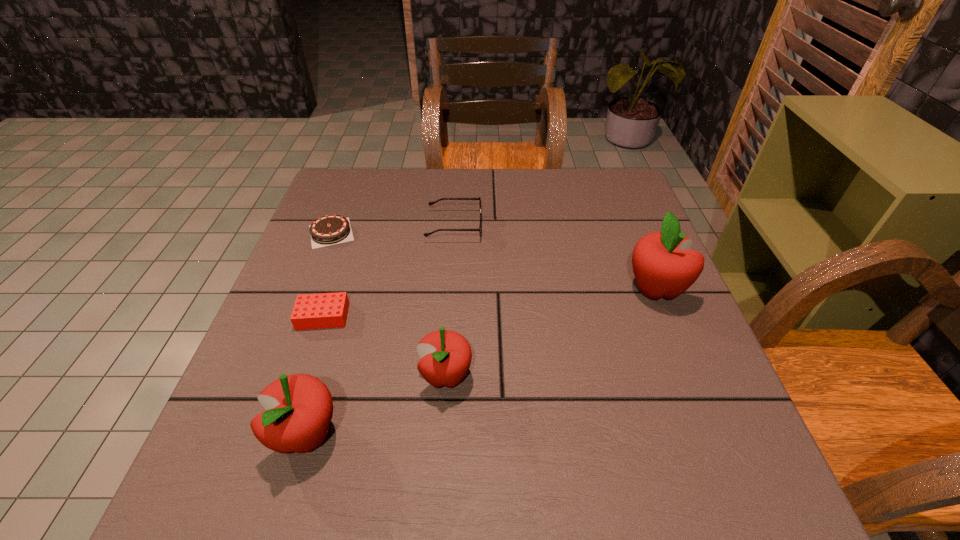
Choose which apple is the third nearest neighbor to the Lego. Please provide its 2D coordinates. Your answer should be formatted as a tuple, i.e. [(x, y)], where the tuple contains the x and y coordinates of a point satisfying the conditions above.

[(664, 266)]

Locate an element on the screen. The height and width of the screenshot is (540, 960). vacant space that satisfies the following two spatial constraints: 1. on the front lenses of the sunglasses; 2. on the back side of the rightmost object is located at coordinates (449, 289).

What are the coordinates of `vacant area in the image that satisfies the following two spatial constraints: 1. on the front side of the shortest object; 2. on the right side of the Lego` in the screenshot? It's located at (299, 316).

I want to click on free point that satisfies the following two spatial constraints: 1. on the front lenses of the sunglasses; 2. on the front side of the Lego, so click(448, 316).